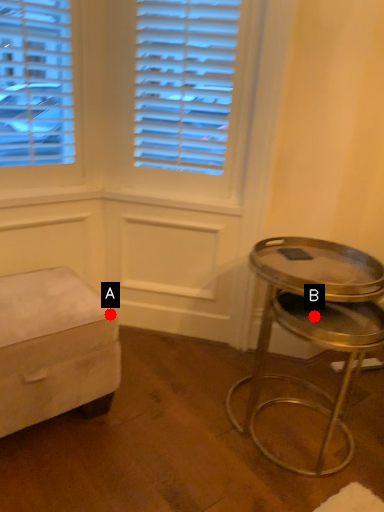
Question: Two points are circled on the image, labeled by A and B beside each circle. Which of the following is the closest to the observer?

Choices:
 (A) A is closer
 (B) B is closer

Answer: (B)